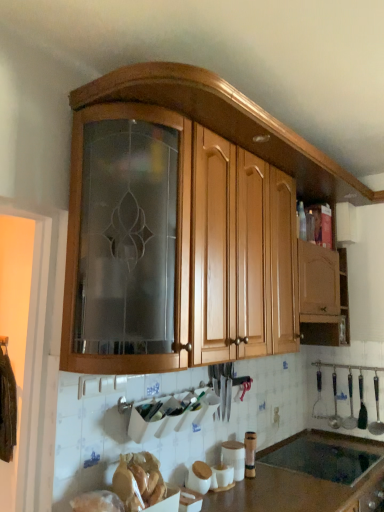
Question: From a real-world perspective, is white matte canister at lower center, the 2th appliance from the right, located beneath polished metal ladle at right, positioned as the first silverware in right-to-left order?

Choices:
 (A) yes
 (B) no

Answer: (A)

Question: Does white matte canister at lower center, the 2th appliance from the right, have a lesser height compared to polished metal ladle at right, which is the 2th silverware in left-to-right order?

Choices:
 (A) yes
 (B) no

Answer: (A)

Question: Is white matte canister at lower center, the second appliance positioned from the back, not close to polished metal ladle at right, which is the 2th silverware in left-to-right order?

Choices:
 (A) no
 (B) yes

Answer: (B)

Question: Is white matte canister at lower center, the 2th appliance from the right, looking in the opposite direction of polished metal ladle at right, which is the 2th silverware in left-to-right order?

Choices:
 (A) yes
 (B) no

Answer: (B)

Question: Is white matte canister at lower center, the 1th appliance when ordered from left to right, in front of polished metal ladle at right, positioned as the first silverware in right-to-left order?

Choices:
 (A) no
 (B) yes

Answer: (B)

Question: From the image's perspective, relative to polished metal ladle at right, positioned as the first silverware in right-to-left order, is white matte canister at lower center, the 2th appliance from the right, above or below?

Choices:
 (A) below
 (B) above

Answer: (A)

Question: Is white matte canister at lower center, the 2th appliance from the right, inside the boundaries of polished metal ladle at right, which is the 2th silverware in left-to-right order, or outside?

Choices:
 (A) inside
 (B) outside

Answer: (B)

Question: In terms of size, does white matte canister at lower center, positioned as the 1th appliance in front-to-back order, appear bigger or smaller than polished metal ladle at right, positioned as the first silverware in right-to-left order?

Choices:
 (A) big
 (B) small

Answer: (B)

Question: Is point (208, 487) closer or farther from the camera than point (377, 430)?

Choices:
 (A) closer
 (B) farther

Answer: (A)

Question: From a real-world perspective, is polished metal ladle at right, which is the 2th silverware in left-to-right order, above or below brown laminate countertop at lower center?

Choices:
 (A) below
 (B) above

Answer: (B)

Question: Considering their positions, is polished metal ladle at right, positioned as the first silverware in right-to-left order, located in front of or behind brown laminate countertop at lower center?

Choices:
 (A) behind
 (B) front

Answer: (A)

Question: Is polished metal ladle at right, positioned as the first silverware in right-to-left order, taller or shorter than brown laminate countertop at lower center?

Choices:
 (A) short
 (B) tall

Answer: (A)

Question: Is point (382, 432) positioned closer to the camera than point (263, 480)?

Choices:
 (A) farther
 (B) closer

Answer: (A)

Question: Considering the positions of wooden cabinet at upper center and white matte canister at lower center, positioned as the 1th appliance in front-to-back order, in the image, is wooden cabinet at upper center wider or thinner than white matte canister at lower center, positioned as the 1th appliance in front-to-back order,?

Choices:
 (A) wide
 (B) thin

Answer: (A)

Question: Considering the positions of wooden cabinet at upper center and white matte canister at lower center, the second appliance positioned from the back, in the image, is wooden cabinet at upper center bigger or smaller than white matte canister at lower center, the second appliance positioned from the back,?

Choices:
 (A) small
 (B) big

Answer: (B)